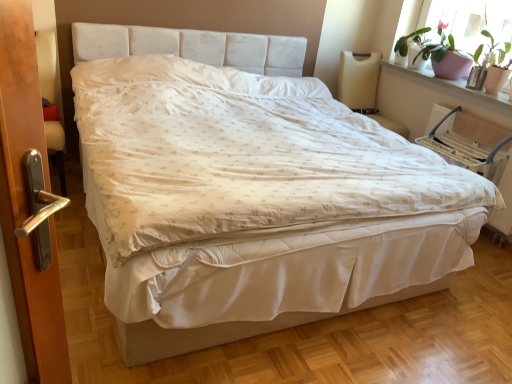
Question: Considering the relative positions of pink ceramic pot at upper right and pink ceramic pot at upper right in the image provided, is pink ceramic pot at upper right in front of pink ceramic pot at upper right?

Choices:
 (A) no
 (B) yes

Answer: (B)

Question: Is pink ceramic pot at upper right to the left of pink ceramic pot at upper right from the viewer's perspective?

Choices:
 (A) yes
 (B) no

Answer: (A)

Question: Does pink ceramic pot at upper right have a greater height compared to pink ceramic pot at upper right?

Choices:
 (A) no
 (B) yes

Answer: (A)

Question: Is pink ceramic pot at upper right completely or partially inside pink ceramic pot at upper right?

Choices:
 (A) no
 (B) yes

Answer: (A)

Question: Is pink ceramic pot at upper right outside of pink ceramic pot at upper right?

Choices:
 (A) yes
 (B) no

Answer: (A)

Question: Is pink ceramic pot at upper right not close to pink ceramic pot at upper right?

Choices:
 (A) yes
 (B) no

Answer: (B)

Question: Does pink ceramic pot at upper right turn towards white fabric armchair at right, marked as the 2th armchair in a left-to-right arrangement?

Choices:
 (A) yes
 (B) no

Answer: (B)

Question: Is pink ceramic pot at upper right further to camera compared to white fabric armchair at right, marked as the 2th armchair in a left-to-right arrangement?

Choices:
 (A) no
 (B) yes

Answer: (B)

Question: Does pink ceramic pot at upper right have a lesser width compared to white fabric armchair at right, marked as the 2th armchair in a left-to-right arrangement?

Choices:
 (A) yes
 (B) no

Answer: (B)

Question: From the image's perspective, is pink ceramic pot at upper right located beneath white fabric armchair at right, the 1th armchair viewed from the right?

Choices:
 (A) no
 (B) yes

Answer: (A)

Question: Is pink ceramic pot at upper right bigger than white fabric armchair at right, the 1th armchair viewed from the right?

Choices:
 (A) yes
 (B) no

Answer: (A)

Question: From a real-world perspective, is pink ceramic pot at upper right positioned over white fabric armchair at right, the 1th armchair viewed from the right, based on gravity?

Choices:
 (A) yes
 (B) no

Answer: (A)

Question: Is white fabric armchair at right, marked as the 2th armchair in a left-to-right arrangement, not near pink ceramic pot at upper right?

Choices:
 (A) no
 (B) yes

Answer: (A)